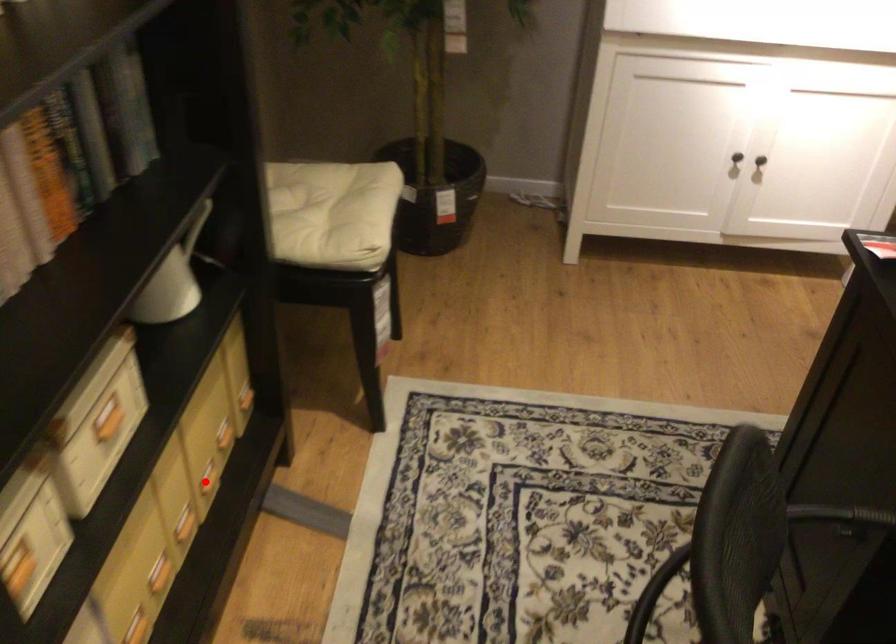
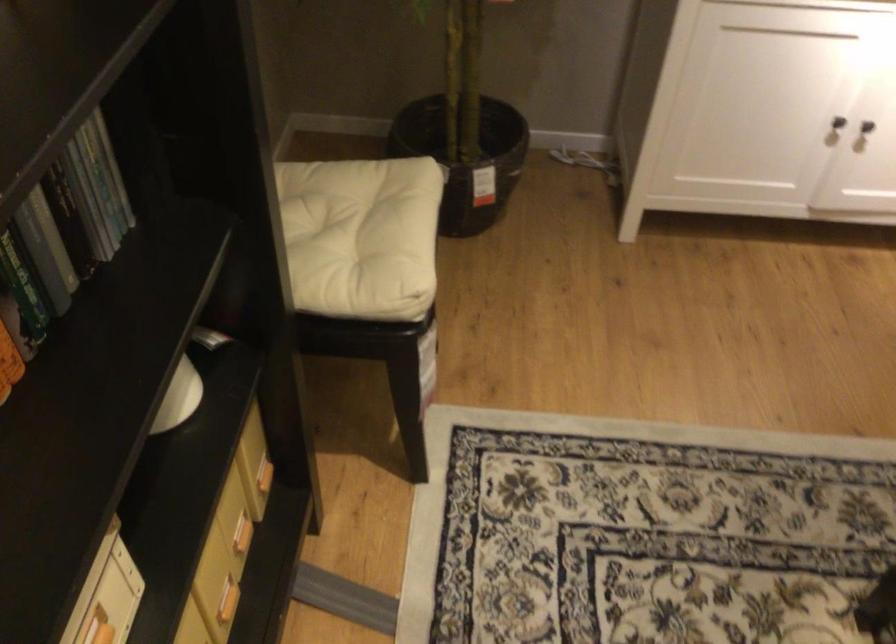
Question: A red point is marked in image1. In image2, is the corresponding 3D point closer to the camera or farther? Reply with the corresponding letter.

Choices:
 (A) The corresponding 3D point is closer.
 (B) The corresponding 3D point is farther.

Answer: (A)